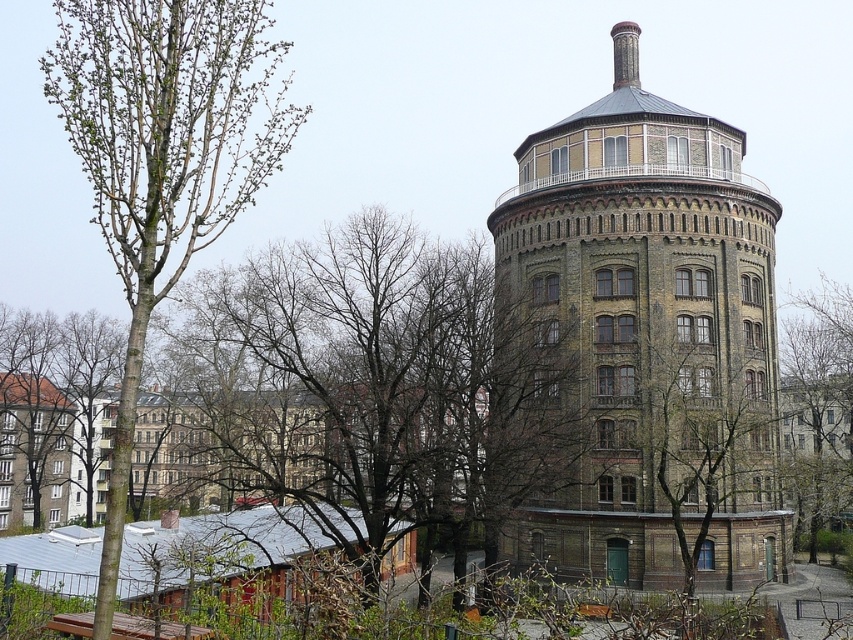
Image resolution: width=853 pixels, height=640 pixels. What do you see at coordinates (650, 340) in the screenshot? I see `brown brick tower at right` at bounding box center [650, 340].

Is brown brick tower at right shorter than green leafy tree at center?

Incorrect, brown brick tower at right's height does not fall short of green leafy tree at center's.

Who is more distant from viewer, (772, 394) or (680, 404)?

Positioned behind is point (772, 394).

This screenshot has width=853, height=640. Find the location of `brown brick tower at right`. brown brick tower at right is located at coordinates (650, 340).

Is brown brick tower at right in front of green leafy tree at left?

No, brown brick tower at right is further to the viewer.

Is brown brick tower at right bigger than green leafy tree at left?

Incorrect, brown brick tower at right is not larger than green leafy tree at left.

Who is more distant from viewer, [706,502] or [115,488]?

Positioned behind is point [706,502].

The image size is (853, 640). In order to click on brown brick tower at right in this screenshot , I will do `click(650, 340)`.

Which of these two, brown brick tower at right or bare branches at left, stands shorter?

Standing shorter between the two is bare branches at left.

Is point (511, 545) behind point (309, 449)?

No, it is not.

Locate an element on the screen. brown brick tower at right is located at coordinates (650, 340).